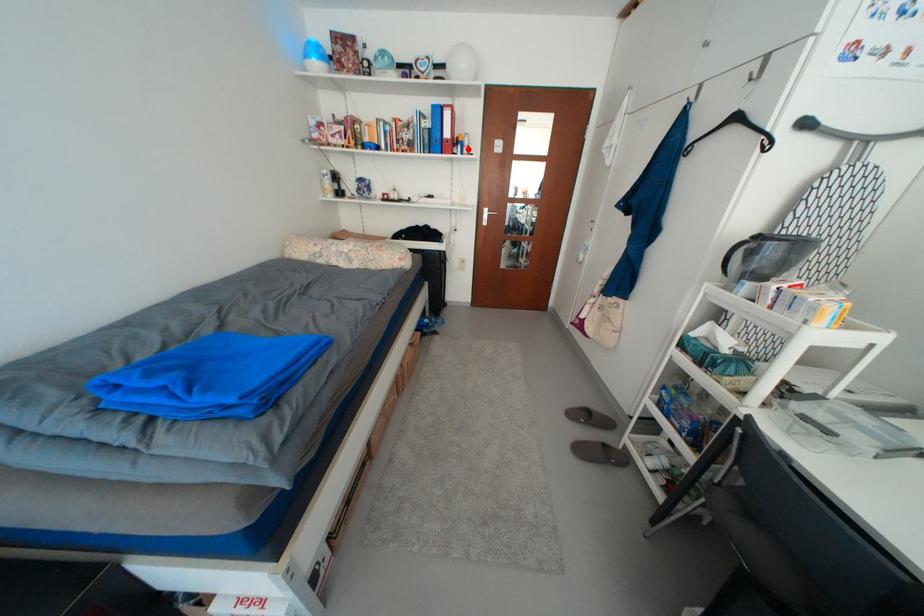
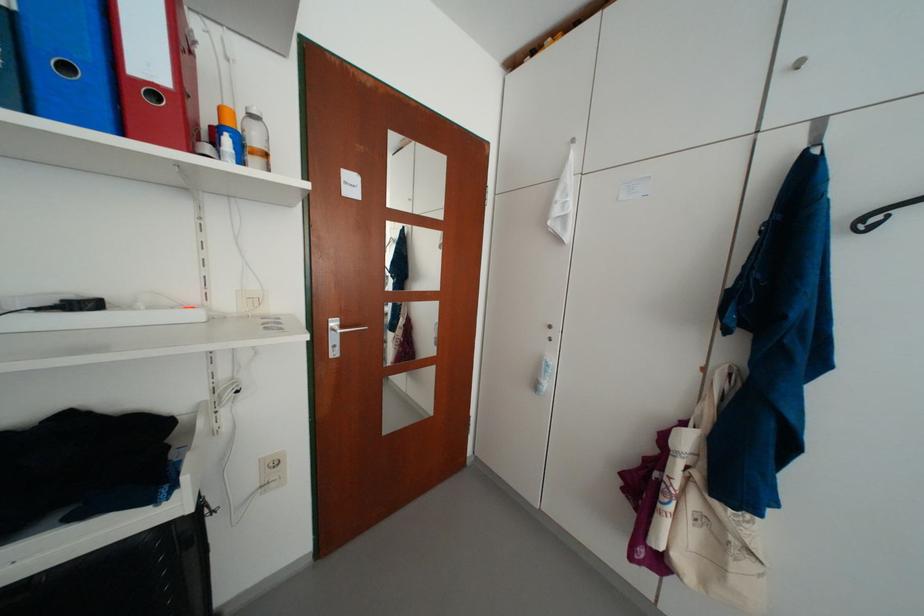
Locate, in the second image, the point that corresponds to the highlighted location in the first image.

(236, 143)